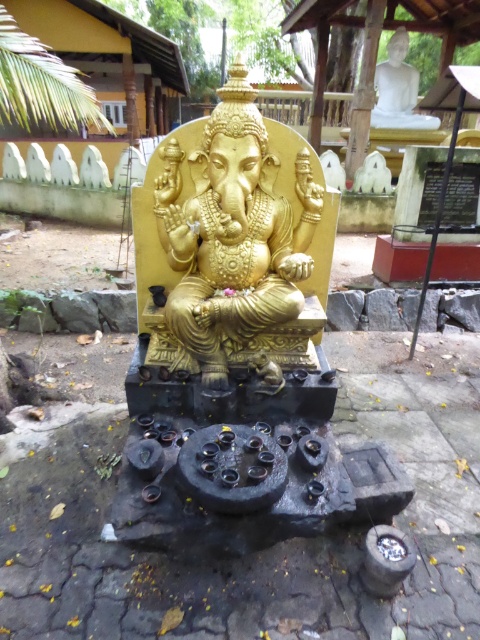
Question: Among these points, which one is nearest to the camera?

Choices:
 (A) (254, 189)
 (B) (381, 99)

Answer: (A)

Question: Does gold polished statue at center have a greater width compared to white marble statue at upper right?

Choices:
 (A) no
 (B) yes

Answer: (A)

Question: Does gold polished statue at center have a smaller size compared to white marble statue at upper right?

Choices:
 (A) yes
 (B) no

Answer: (A)

Question: Is gold polished statue at center below white marble statue at upper right?

Choices:
 (A) no
 (B) yes

Answer: (B)